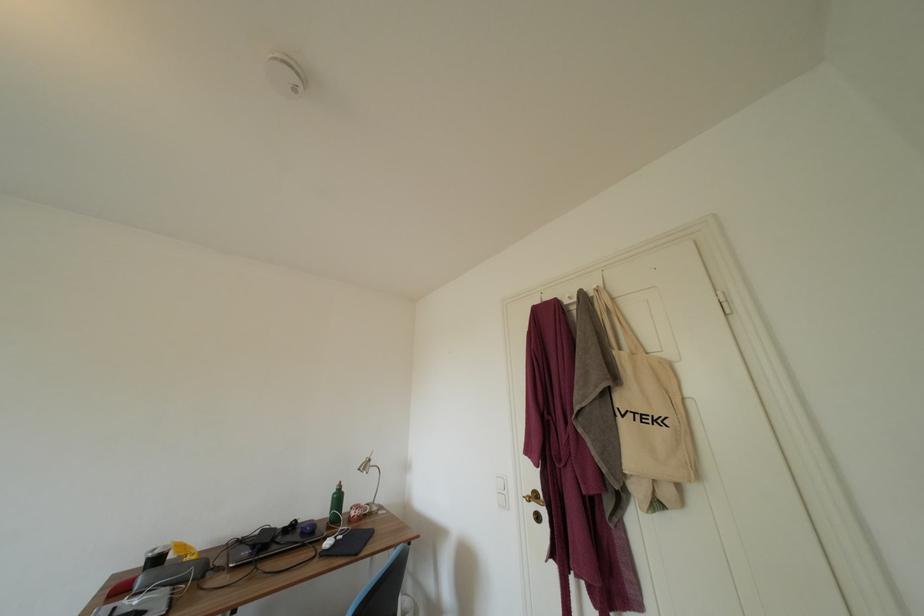
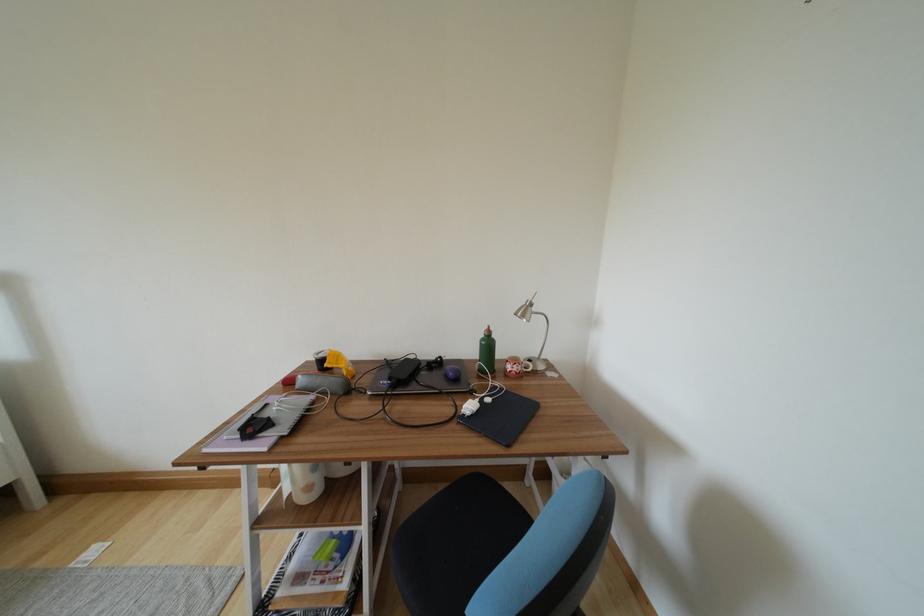
The point at (343, 501) is marked in the first image. Where is the corresponding point in the second image?

(493, 349)